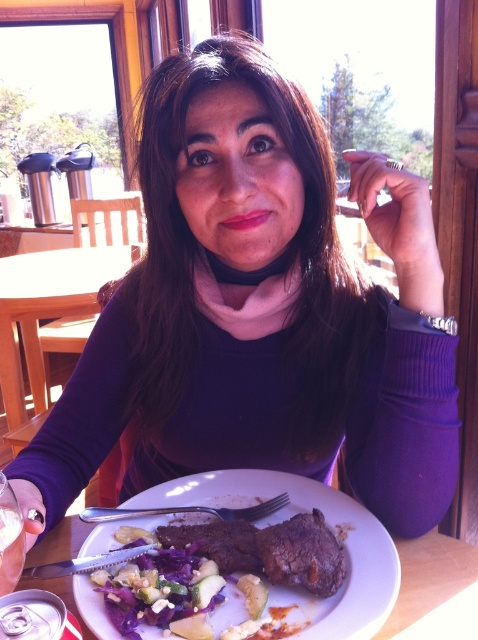
You are sitting at the table in the image and want to place your napkin between the two points, point [227,552] and point [321,554]. Which point should you place the napkin closer to so that it is in front of the other point?

You should place the napkin closer to point [321,554] because point [227,552] is behind it, so the napkin will be in front of point [227,552] when placed near point [321,554].

You are a food delivery person who needs to confirm the order details. The customer ordered a steak with vegetables. Looking at the brown seared steak at plate center and the dark brown steak at plate center, which one is taller?

The brown seared steak at plate center is taller than the dark brown steak at plate center.